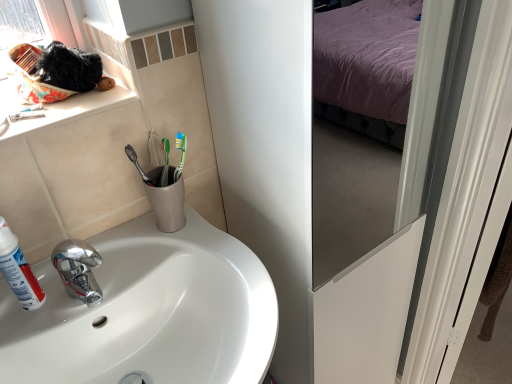
This screenshot has height=384, width=512. What do you see at coordinates (18, 270) in the screenshot?
I see `white matte shaving cream at left` at bounding box center [18, 270].

This screenshot has height=384, width=512. What are the coordinates of `white matte shaving cream at left` in the screenshot? It's located at (18, 270).

Where is `white glossy sink at lower left`? Image resolution: width=512 pixels, height=384 pixels. white glossy sink at lower left is located at coordinates (149, 312).

Describe the element at coordinates (149, 312) in the screenshot. I see `white glossy sink at lower left` at that location.

This screenshot has height=384, width=512. What are the coordinates of `white matte shaving cream at left` in the screenshot? It's located at (18, 270).

Which is more to the left, white matte shaving cream at left or white glossy sink at lower left?

From the viewer's perspective, white matte shaving cream at left appears more on the left side.

Considering their positions, is white matte shaving cream at left located in front of or behind white glossy sink at lower left?

In the image, white matte shaving cream at left appears behind white glossy sink at lower left.

Between point (15, 235) and point (15, 346), which one is positioned in front?

The point (15, 346) is more forward.

From the image's perspective, is white matte shaving cream at left located above white glossy sink at lower left?

Yes, from the image's perspective, white matte shaving cream at left is above white glossy sink at lower left.

From a real-world perspective, is white matte shaving cream at left located beneath white glossy sink at lower left?

No, from a real-world perspective, white matte shaving cream at left is not below white glossy sink at lower left.

Can you confirm if white matte shaving cream at left is wider than white glossy sink at lower left?

Incorrect, the width of white matte shaving cream at left does not surpass that of white glossy sink at lower left.

Between white matte shaving cream at left and white glossy sink at lower left, which one has less height?

white matte shaving cream at left is shorter.

In terms of size, does white matte shaving cream at left appear bigger or smaller than white glossy sink at lower left?

white matte shaving cream at left is smaller than white glossy sink at lower left.

Is white glossy sink at lower left located within white matte shaving cream at left?

No.

Is white matte shaving cream at left placed right next to white glossy sink at lower left?

No, white matte shaving cream at left is not with white glossy sink at lower left.

Is white glossy sink at lower left at the back of white matte shaving cream at left?

No, white matte shaving cream at left is not facing away from white glossy sink at lower left.

How far apart are white matte shaving cream at left and white glossy sink at lower left?

The distance of white matte shaving cream at left from white glossy sink at lower left is 7.98 inches.

Where is `sink below the white matte shaving cream at left (from a real-world perspective)`? Image resolution: width=512 pixels, height=384 pixels. sink below the white matte shaving cream at left (from a real-world perspective) is located at coordinates point(149,312).

Considering the positions of objects white glossy sink at lower left and white matte shaving cream at left in the image provided, who is more to the left, white glossy sink at lower left or white matte shaving cream at left?

From the viewer's perspective, white matte shaving cream at left appears more on the left side.

Relative to white matte shaving cream at left, is white glossy sink at lower left in front or behind?

In the image, white glossy sink at lower left appears in front of white matte shaving cream at left.

Is point (269, 345) positioned before point (27, 268)?

That is True.

From the image's perspective, is white glossy sink at lower left located beneath white matte shaving cream at left?

Correct, white glossy sink at lower left appears lower than white matte shaving cream at left in the image.

From a real-world perspective, is white glossy sink at lower left physically located above or below white matte shaving cream at left?

white glossy sink at lower left is below white matte shaving cream at left.

Which of these two, white glossy sink at lower left or white matte shaving cream at left, is thinner?

white matte shaving cream at left.

Consider the image. Is white glossy sink at lower left taller than white matte shaving cream at left?

Yes.

Based on the photo, who is smaller, white glossy sink at lower left or white matte shaving cream at left?

With smaller size is white matte shaving cream at left.

Can white matte shaving cream at left be found inside white glossy sink at lower left?

No, white glossy sink at lower left does not contain white matte shaving cream at left.

Based on the photo, are white glossy sink at lower left and white matte shaving cream at left far apart?

No, white glossy sink at lower left is in close proximity to white matte shaving cream at left.

Is white glossy sink at lower left looking in the opposite direction of white matte shaving cream at left?

No.

Find the location of a particular element. The image size is (512, 384). sink beneath the white matte shaving cream at left (from a real-world perspective) is located at coordinates (149, 312).

In order to click on sink in front of the white matte shaving cream at left in this screenshot , I will do `click(149, 312)`.

You are a GUI agent. You are given a task and a screenshot of the screen. Output one action in this format:
    pyautogui.click(x=<x>, y=<y>)
    Task: Click on the shaving cream that appears above the white glossy sink at lower left (from a real-world perspective)
    This screenshot has height=384, width=512.
    Given the screenshot: What is the action you would take?
    pyautogui.click(x=18, y=270)